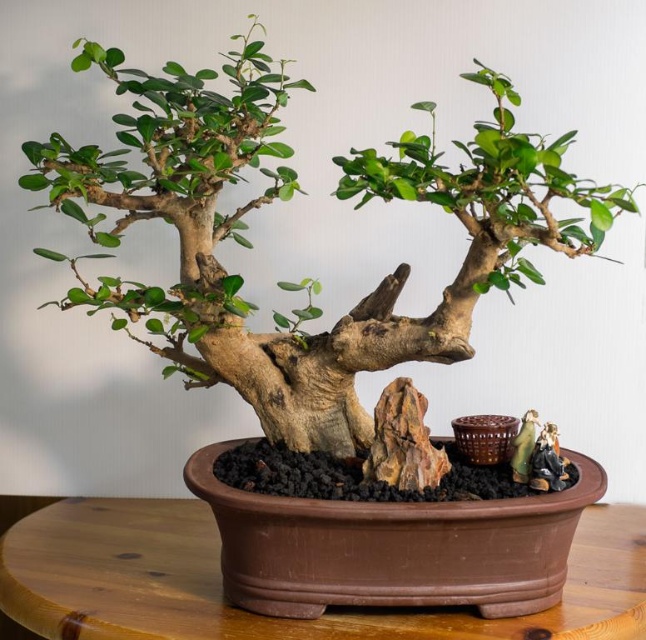
You are a gardener who wants to move the brown textured bonsai tree at center and the brown wooden table at center to a new location. However, you have a limited space that can only accommodate one of them. Based on their sizes, which object should you prioritize moving first?

The brown textured bonsai tree at center is bigger than the brown wooden table at center, so you should prioritize moving the brown wooden table at center first since it is smaller and requires less space.

You are arranging a display in a small space and need to place both the brown textured bonsai tree at center and the brown wooden table at center. Given their sizes, which object should you place first to ensure they fit properly?

The brown textured bonsai tree at center has a lesser width compared to the brown wooden table at center, so you should place the brown wooden table at center first to accommodate its larger size and then position the bonsai tree appropriately.

You are positioning a small decorative stone in the image. To ensure it is placed exactly at the base of the brown textured bonsai tree at center, where should you place it according to the coordinates provided?

The brown textured bonsai tree at center is located at point (286, 198), so the decorative stone should be placed near those coordinates to be at its base.